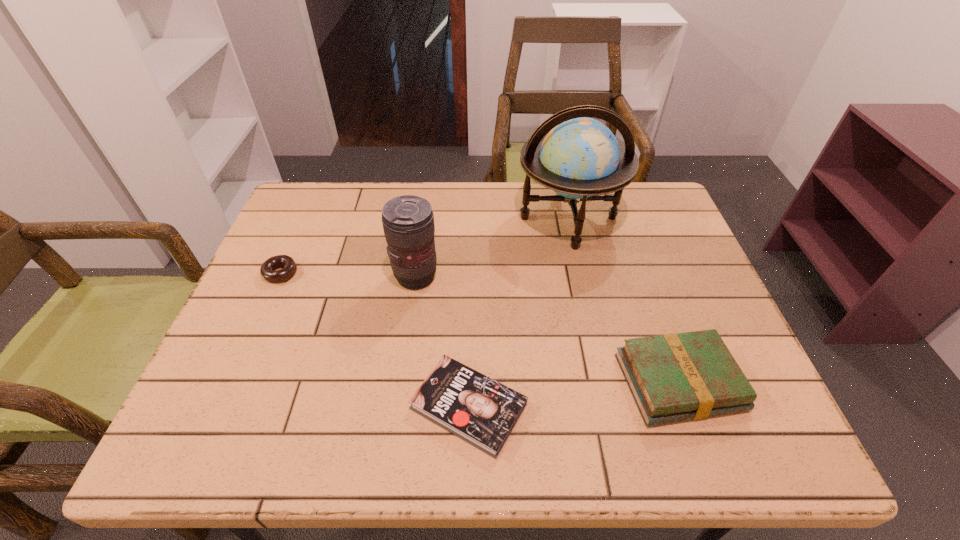
Find the location of a particular element. vacant region at the near edge of the desktop is located at coordinates (618, 458).

This screenshot has height=540, width=960. I want to click on vacant region at the left edge of the desktop, so click(267, 338).

Locate an element on the screen. This screenshot has height=540, width=960. vacant space at the right edge is located at coordinates (651, 286).

Find the location of a particular element. free space at the far left corner of the desktop is located at coordinates (320, 190).

In the image, there is a desktop. Where is `free space at the far right corner`? free space at the far right corner is located at coordinates (612, 204).

The height and width of the screenshot is (540, 960). I want to click on vacant space in between the telephoto lens and the third shortest object, so click(x=547, y=329).

At what (x,y) coordinates should I click in order to perform the action: click on vacant area that lies between the fourth shortest object and the globe. Please return your answer as a coordinate pair (x, y). The image size is (960, 540). Looking at the image, I should click on (492, 247).

The height and width of the screenshot is (540, 960). I want to click on free space between the third shortest object and the globe, so click(x=623, y=300).

Where is `free space between the tallest object and the shortest object`? free space between the tallest object and the shortest object is located at coordinates (518, 312).

The height and width of the screenshot is (540, 960). What are the coordinates of `vacant space that is in between the taller book and the leftmost object` in the screenshot? It's located at (479, 327).